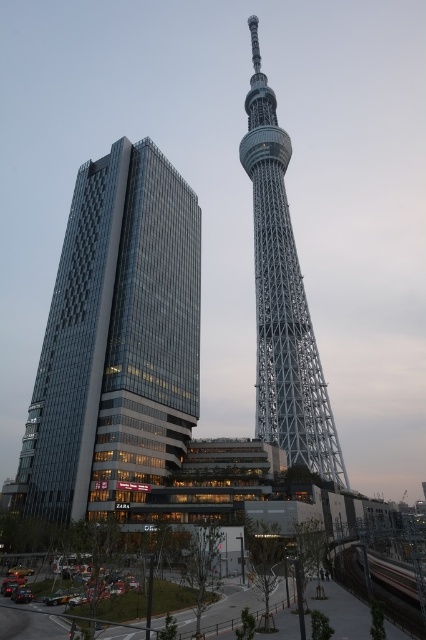
You are a photographer planning to capture a photo of the glassy modern building at left and the silver metallic eiffel tower at center. Which structure will appear closer to the camera in your photo?

The glassy modern building at left will appear closer to the camera because it is positioned in front of the silver metallic eiffel tower at center.

You are standing in the middle of a park and see the glassy modern building at left and the silver metallic eiffel tower at center. Which one is positioned more to the east? Please explain your reasoning based on their relative positions.

The glassy modern building at left is positioned more to the east because it is located to the left of the silver metallic eiffel tower at center, and in the image, left corresponds to the east direction.

You are an architect analyzing the urban layout of this cityscape. Given the spatial relationship between the glassy modern building at left and the silver metallic eiffel tower at center, which structure would require a wider foundation to support its base?

The glassy modern building at left requires a wider foundation because its width is larger than the silver metallic eiffel tower at center, necessitating a broader base to ensure structural stability.